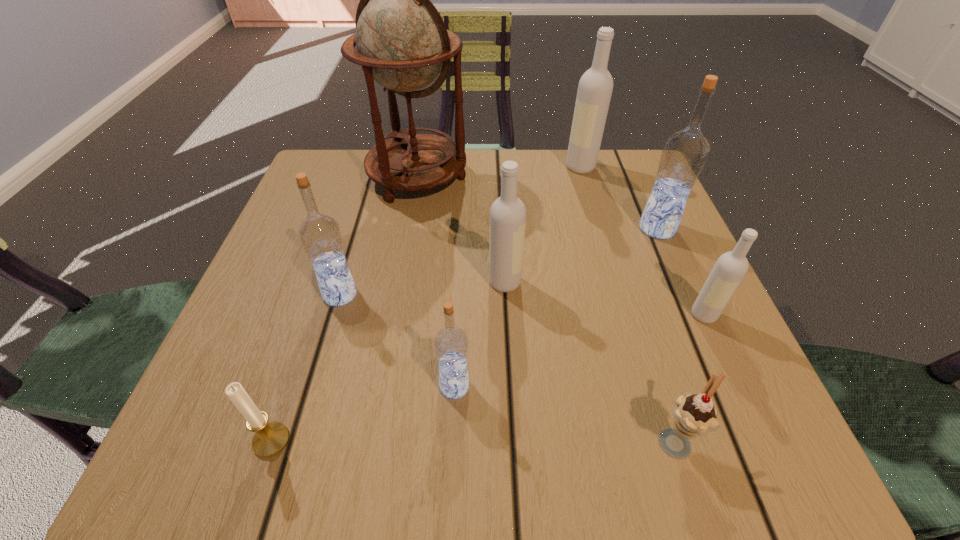
Identify the location of free space in the image that satisfies the following two spatial constraints: 1. on the surface of the globe; 2. on the left side of the nearest white vodka. Image resolution: width=960 pixels, height=540 pixels. (395, 315).